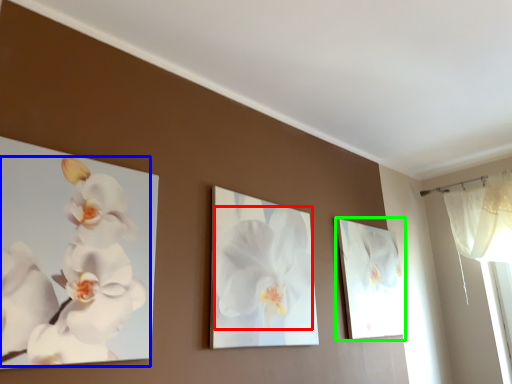
Question: Which object is the closest to the flower (highlighted by a red box)? Choose among these: flower (highlighted by a blue box) or picture frame (highlighted by a green box).

Choices:
 (A) flower
 (B) picture frame

Answer: (A)